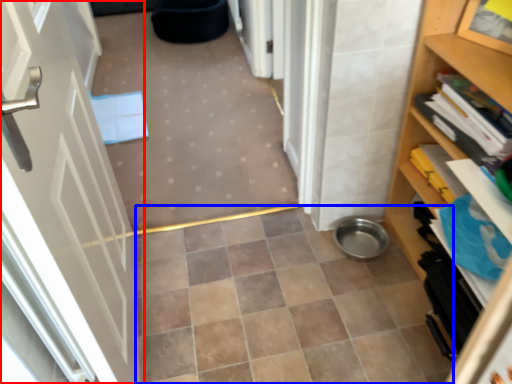
Question: Among these objects, which one is nearest to the camera, door (highlighted by a red box) or ceramic tile (highlighted by a blue box)?

Choices:
 (A) door
 (B) ceramic tile

Answer: (A)